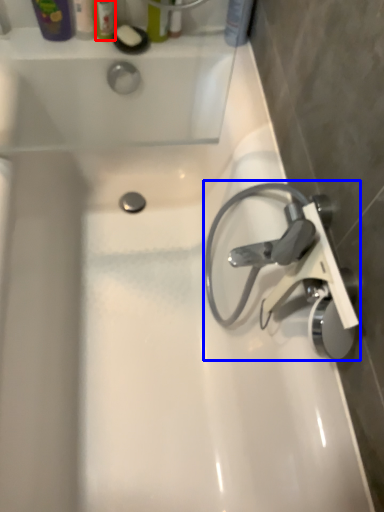
Question: Among these objects, which one is nearest to the camera, toiletry (highlighted by a red box) or tap (highlighted by a blue box)?

Choices:
 (A) toiletry
 (B) tap

Answer: (B)